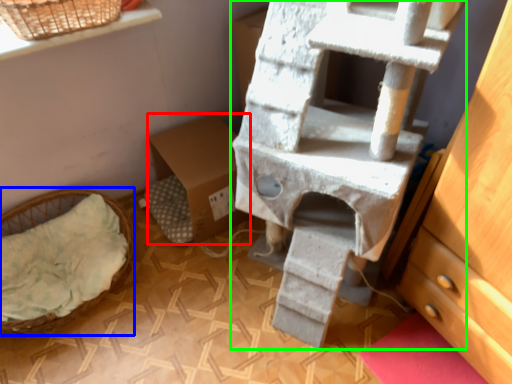
Question: Based on their relative distances, which object is farther from cardboard box (highlighted by a red box)? Choose from furniture (highlighted by a blue box) and bunk bed (highlighted by a green box).

Choices:
 (A) furniture
 (B) bunk bed

Answer: (B)